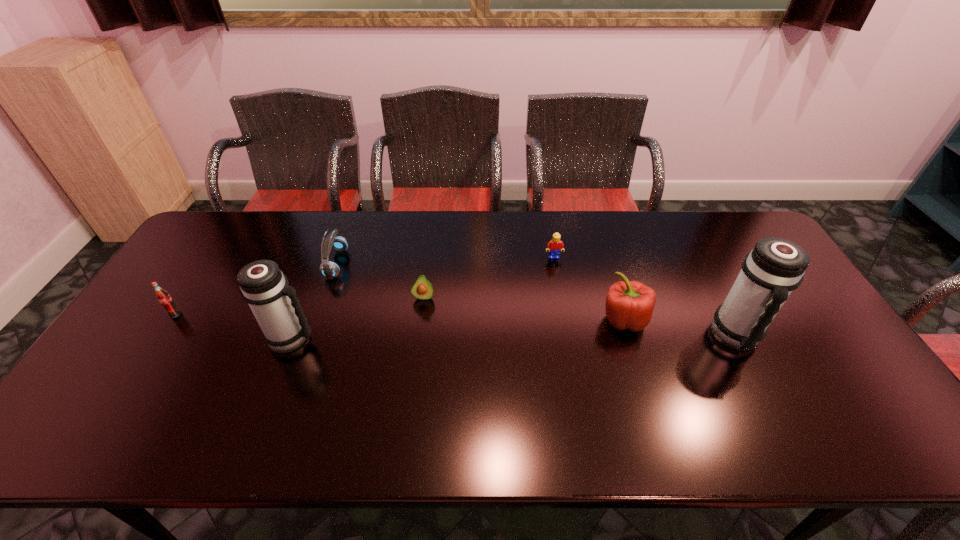
This screenshot has height=540, width=960. Find the location of `vacant point located on the side with the handle of the sixth shortest object`. vacant point located on the side with the handle of the sixth shortest object is located at coordinates (382, 338).

Locate an element on the screen. vacant space positioned on the front-facing side of the Lego is located at coordinates (566, 327).

Locate an element on the screen. The width and height of the screenshot is (960, 540). blank area located 0.300m on the ear cups of the headset is located at coordinates (440, 264).

Find the location of `vacant space located 0.210m on the cut side of the fifth nearest object`. vacant space located 0.210m on the cut side of the fifth nearest object is located at coordinates (415, 362).

What are the coordinates of `vacant space located 0.120m on the label of the soda bottle` in the screenshot? It's located at (150, 353).

The width and height of the screenshot is (960, 540). Find the location of `free point located on the right of the sixth object from left to right`. free point located on the right of the sixth object from left to right is located at coordinates (730, 320).

Where is `Lego situated at the far edge`? The width and height of the screenshot is (960, 540). Lego situated at the far edge is located at coordinates (554, 246).

Locate an element on the screen. The width and height of the screenshot is (960, 540). headset situated at the far edge is located at coordinates (334, 240).

Locate an element on the screen. Image resolution: width=960 pixels, height=540 pixels. object positioned at the left edge is located at coordinates (164, 298).

Locate an element on the screen. vacant space at the far edge is located at coordinates (620, 212).